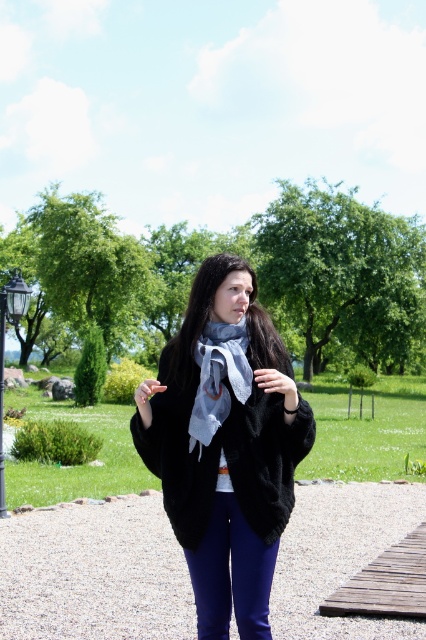
Is gravel at center thinner than black fuzzy coat at center?

No, gravel at center is not thinner than black fuzzy coat at center.

How distant is gravel at center from black fuzzy coat at center?

2.54 meters

Which is behind, point (331, 582) or point (267, 588)?

Point (331, 582)

In order to click on gravel at center in this screenshot , I will do `click(94, 573)`.

This screenshot has width=426, height=640. Find the location of `gravel at center`. gravel at center is located at coordinates (94, 573).

Does gravel at center appear over black metal lamp post at lower left?

No.

What do you see at coordinates (94, 573) in the screenshot? I see `gravel at center` at bounding box center [94, 573].

Identify the location of gravel at center. This screenshot has height=640, width=426. (94, 573).

Can you confirm if gravel at center is wider than light blue sheer scarf at center?

Yes, gravel at center is wider than light blue sheer scarf at center.

Between gravel at center and light blue sheer scarf at center, which one has more height?

Standing taller between the two is light blue sheer scarf at center.

Who is more distant from viewer, (129, 595) or (222, 362)?

The point (129, 595) is behind.

You are a GUI agent. You are given a task and a screenshot of the screen. Output one action in this format:
    pyautogui.click(x=<x>, y=<y>)
    Task: Click on the gravel at center
    
    Given the screenshot: What is the action you would take?
    pyautogui.click(x=94, y=573)